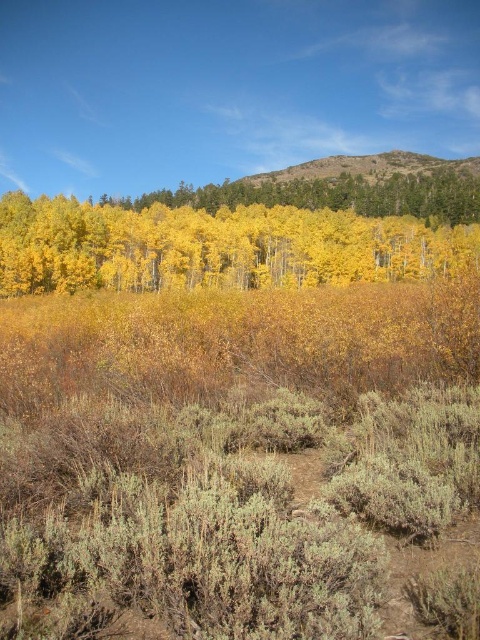
Question: Is yellow matte trees at center to the left of yellow matte tree at upper center from the viewer's perspective?

Choices:
 (A) yes
 (B) no

Answer: (B)

Question: Among these points, which one is nearest to the camera?

Choices:
 (A) (68, 275)
 (B) (451, 182)

Answer: (A)

Question: Does yellow matte trees at center have a smaller size compared to yellow matte tree at upper center?

Choices:
 (A) no
 (B) yes

Answer: (B)

Question: Which object is farther from the camera taking this photo?

Choices:
 (A) yellow matte tree at upper center
 (B) yellow matte trees at center

Answer: (A)

Question: Is yellow matte trees at center bigger than yellow matte tree at upper center?

Choices:
 (A) yes
 (B) no

Answer: (B)